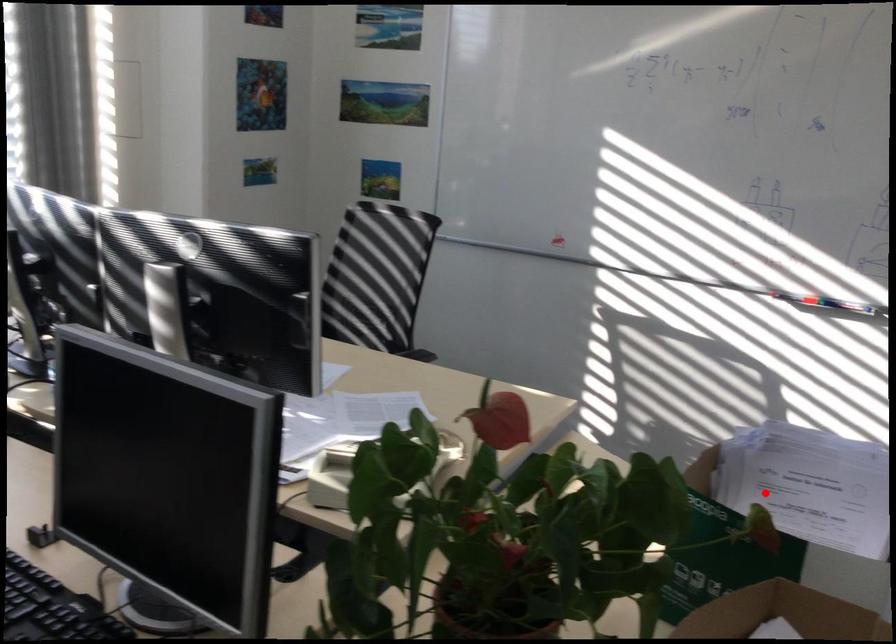
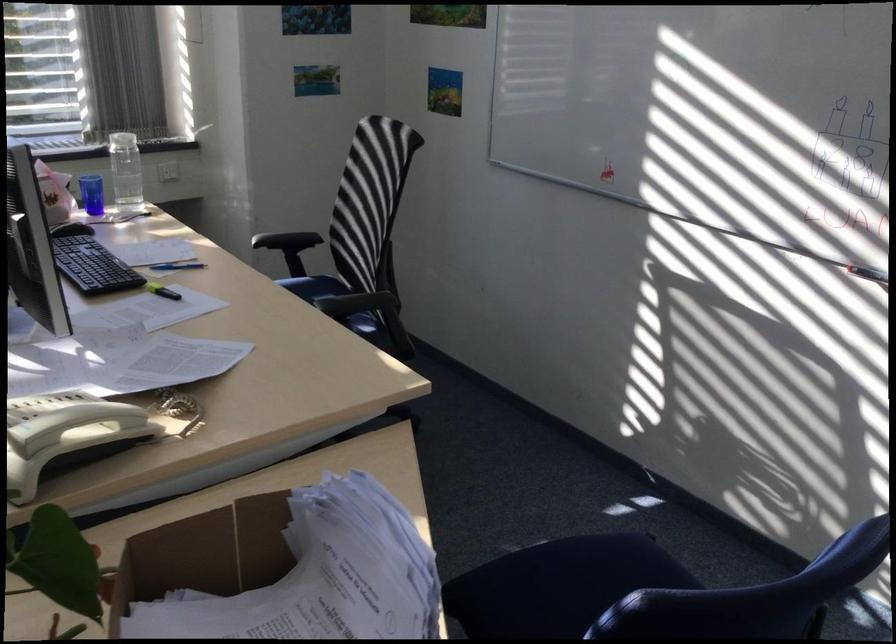
In the second image, find the point that corresponds to the highlighted location in the first image.

(319, 576)